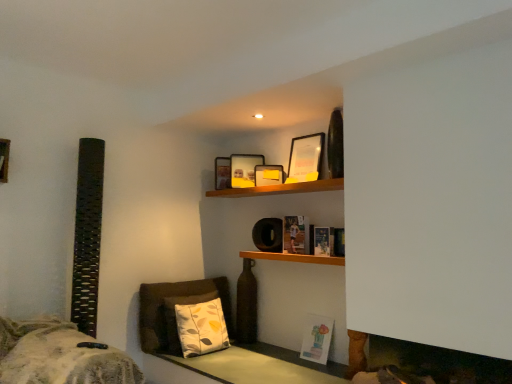
At what (x,y) coordinates should I click in order to perform the action: click on empty space that is ontop of pastel paper book at lower right, the third book from the top. Please return your answer as a coordinate pair (x, y). Image resolution: width=512 pixels, height=384 pixels. Looking at the image, I should click on (323, 310).